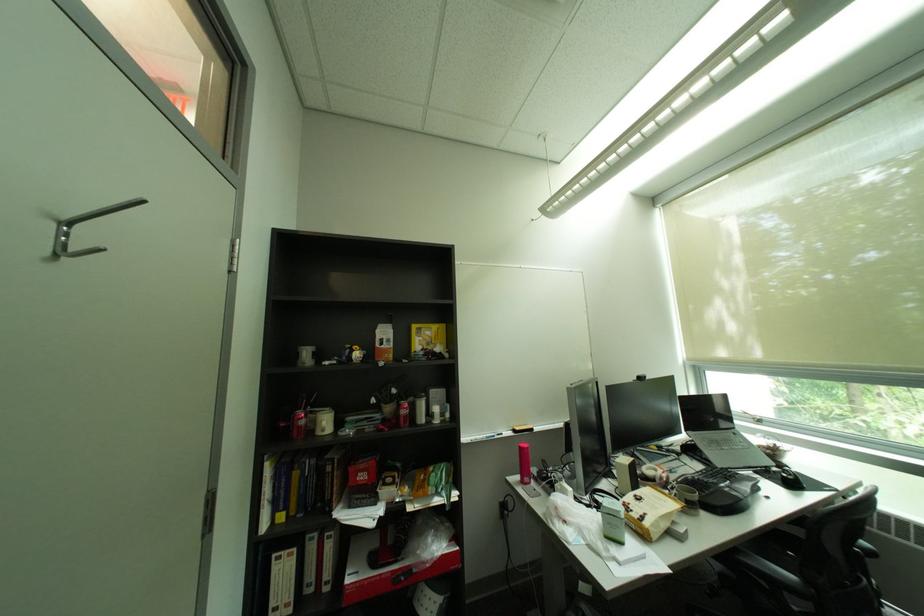
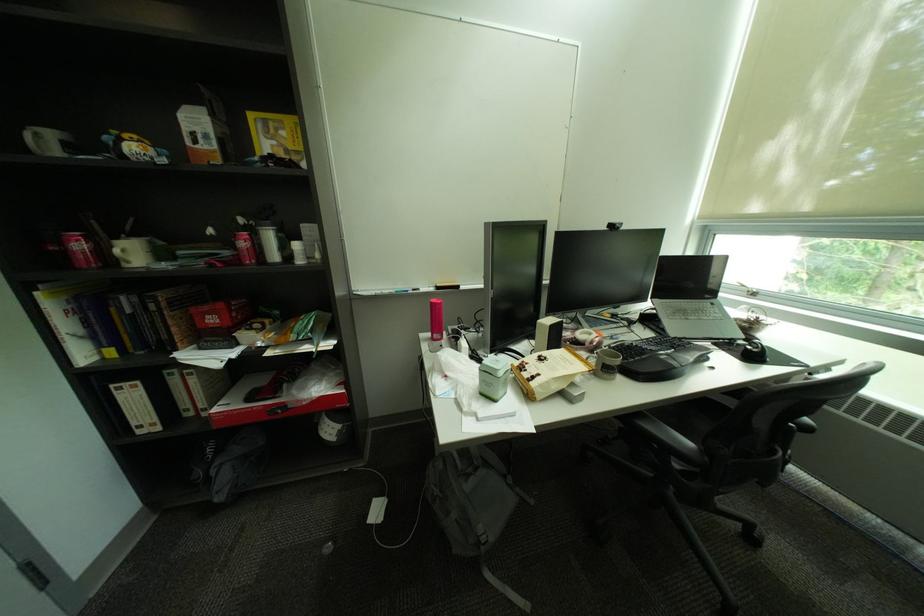
Where in the second image is the point corresponding to [528,430] from the first image?

(450, 286)